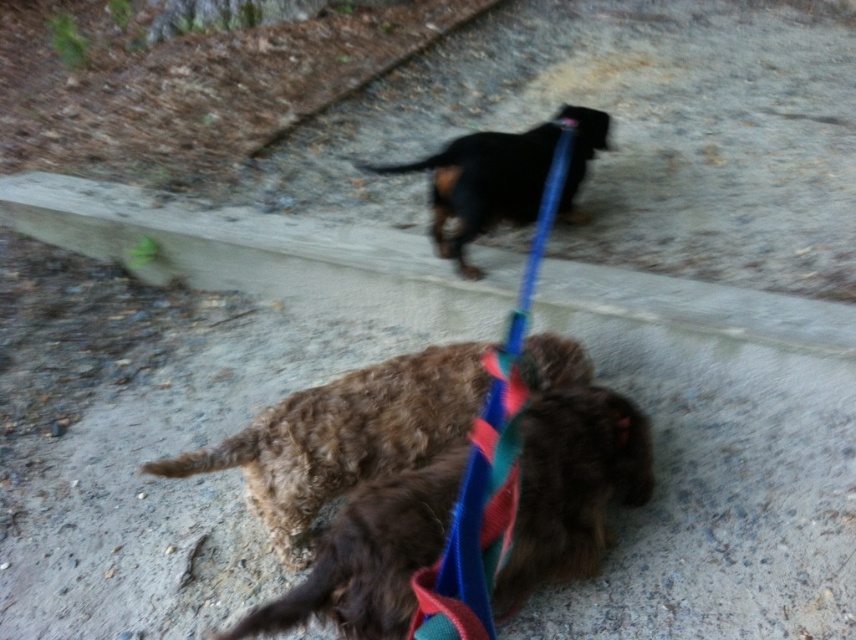
Question: Which of the following is the closest to the observer?

Choices:
 (A) black glossy dog at upper center
 (B) blue fabric leash at upper center
 (C) curly brown fur at center
 (D) brown curly fur dog at center

Answer: (B)

Question: Can you confirm if curly brown fur at center is positioned below blue fabric leash at upper center?

Choices:
 (A) no
 (B) yes

Answer: (A)

Question: Does brown curly fur dog at center appear on the right side of black glossy dog at upper center?

Choices:
 (A) no
 (B) yes

Answer: (A)

Question: Which object appears farthest from the camera in this image?

Choices:
 (A) black glossy dog at upper center
 (B) blue fabric leash at upper center

Answer: (A)

Question: In this image, where is brown curly fur dog at center located relative to black glossy dog at upper center?

Choices:
 (A) right
 (B) left

Answer: (B)

Question: Considering the real-world distances, which object is closest to the black glossy dog at upper center?

Choices:
 (A) blue fabric leash at upper center
 (B) curly brown fur at center
 (C) brown curly fur dog at center

Answer: (B)